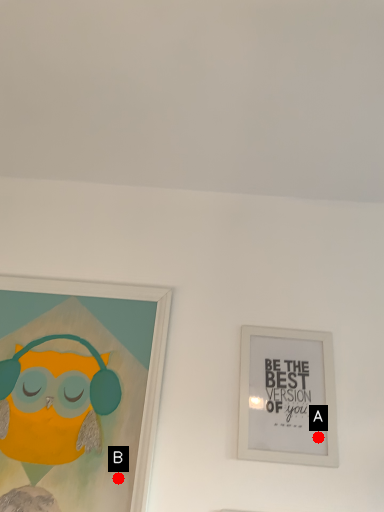
Question: Two points are circled on the image, labeled by A and B beside each circle. Which point is farther from the camera taking this photo?

Choices:
 (A) A is further
 (B) B is further

Answer: (A)